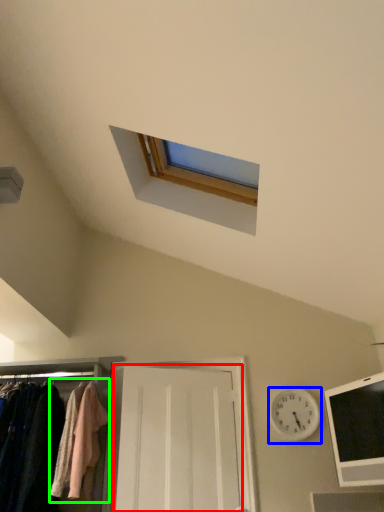
Question: Considering the real-world distances, which object is farthest from door (highlighted by a red box)? clock (highlighted by a blue box) or clothing (highlighted by a green box)?

Choices:
 (A) clock
 (B) clothing

Answer: (A)